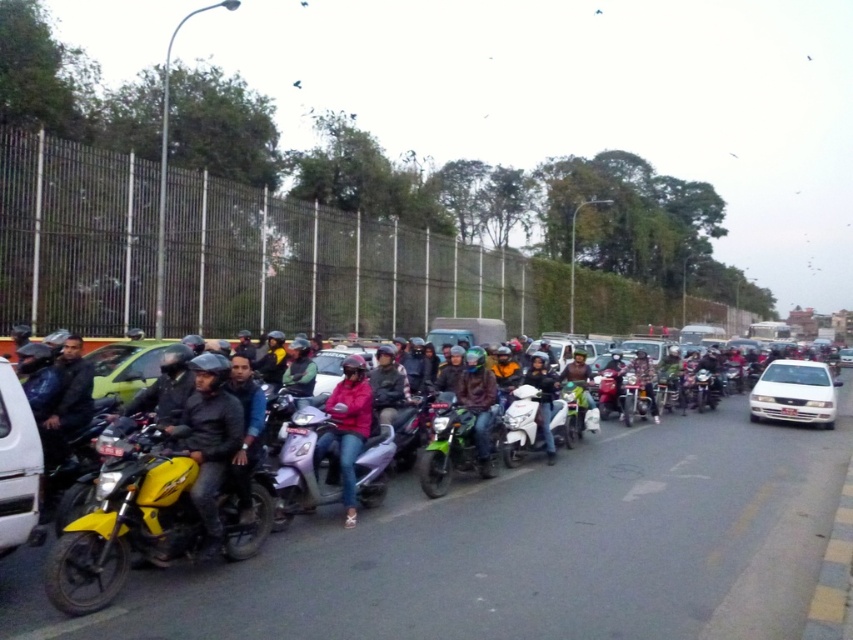
Question: Estimate the real-world distances between objects in this image. Which object is farther from the matte green car at center?

Choices:
 (A) green matte jacket at center
 (B) white glossy scooter at center
 (C) yellow matte motorcycle at left
 (D) dark brown leather jacket at center

Answer: (B)

Question: Is purple matte scooter at center bigger than metallic silver scooter at center?

Choices:
 (A) yes
 (B) no

Answer: (A)

Question: Among these objects, which one is nearest to the camera?

Choices:
 (A) white glossy sedan at right
 (B) dark brown leather jacket at center

Answer: (B)

Question: Can you confirm if purple matte scooter at center is positioned below metallic silver scooter at center?

Choices:
 (A) no
 (B) yes

Answer: (A)

Question: Considering the real-world distances, which object is closest to the dark gray leather jacket at center?

Choices:
 (A) pink matte jacket at center
 (B) dark brown leather jacket at center
 (C) matte green car at center

Answer: (B)

Question: Is dark brown leather jacket at center further to the viewer compared to dark gray leather jacket at center?

Choices:
 (A) yes
 (B) no

Answer: (A)